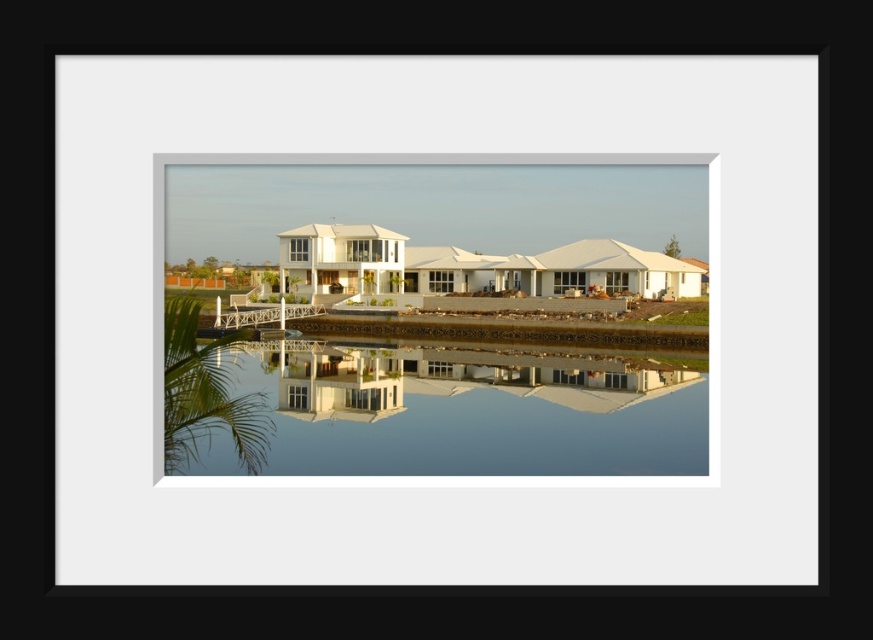
You are standing in front of the house and notice two points marked in the scene. The first point is at coordinate point (x=328, y=204) and the second is at point (x=260, y=308). Which point is closer to your current position?

Point (x=260, y=308) is closer to your current position because it is closer to the camera than point (x=328, y=204).

You are standing at the edge of the water in the scene and want to walk towards the house. Which of the two points, point (x=359, y=417) or point (x=277, y=310), would you encounter first?

Point (x=359, y=417) is in front of point (x=277, y=310), so you would encounter point (x=359, y=417) first as you walk towards the house.